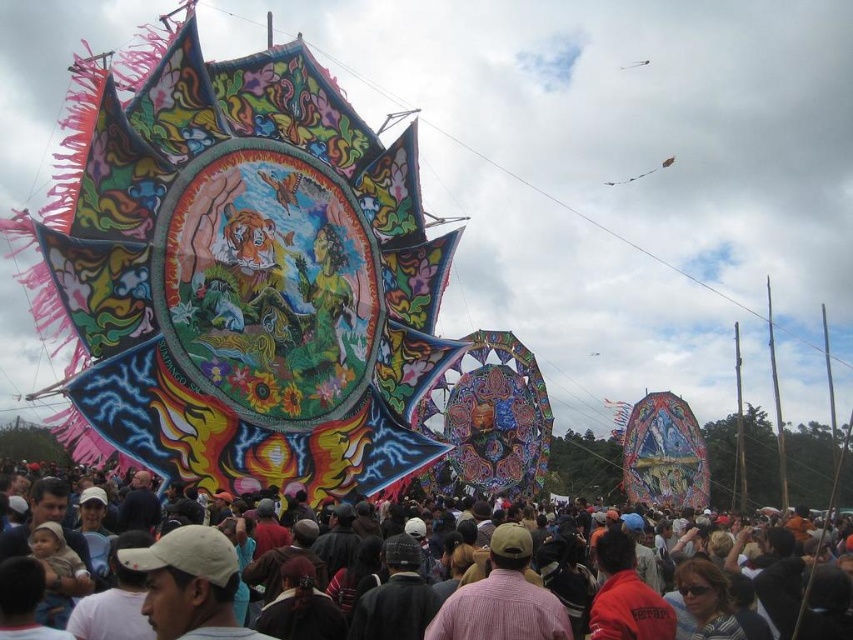
Between matte black crowd at center and pink woven shirt at center, which one appears on the right side from the viewer's perspective?

From the viewer's perspective, matte black crowd at center appears more on the right side.

Does matte black crowd at center have a larger size compared to pink woven shirt at center?

Yes.

Who is more forward, (1, 552) or (512, 577)?

Point (1, 552) is more forward.

I want to click on matte black crowd at center, so click(x=793, y=595).

From the picture: Is matte black crowd at center thinner than transparent plastic kite at upper center?

Incorrect, matte black crowd at center's width is not less than transparent plastic kite at upper center's.

Identify the location of matte black crowd at center. (793, 595).

Locate an element on the screen. This screenshot has height=640, width=853. matte black crowd at center is located at coordinates (793, 595).

Does translucent plastic kite at upper center have a lesser height compared to transparent plastic kite at upper center?

Incorrect, translucent plastic kite at upper center's height does not fall short of transparent plastic kite at upper center's.

Does translucent plastic kite at upper center have a greater height compared to transparent plastic kite at upper center?

Correct, translucent plastic kite at upper center is much taller as transparent plastic kite at upper center.

The image size is (853, 640). What are the coordinates of `translucent plastic kite at upper center` in the screenshot? It's located at (642, 172).

What are the coordinates of `translucent plastic kite at upper center` in the screenshot? It's located at (642, 172).